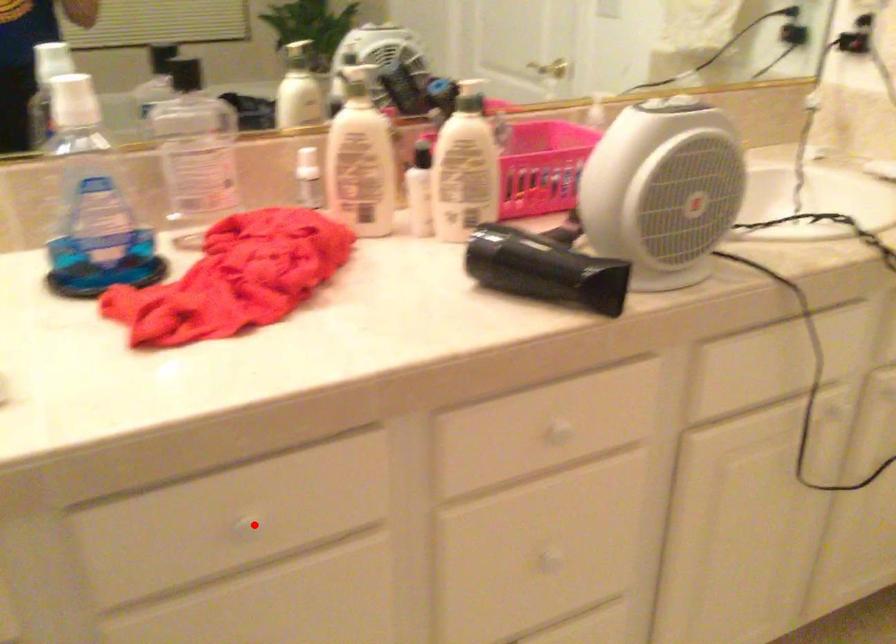
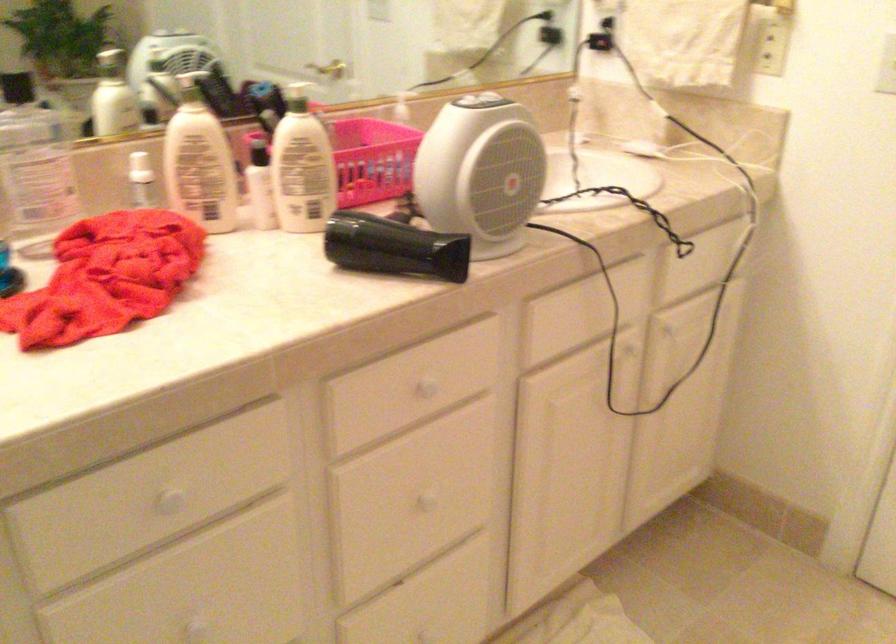
Where in the second image is the point corresponding to the highlighted location from the first image?

(169, 500)